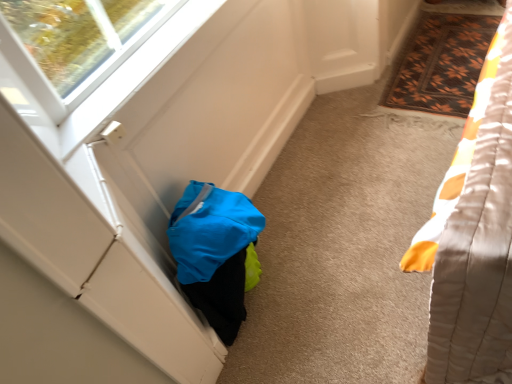
What do you see at coordinates (86, 58) in the screenshot? I see `clear glass window at upper left` at bounding box center [86, 58].

Locate an element on the screen. This screenshot has height=384, width=512. clear glass window at upper left is located at coordinates (86, 58).

At what (x,y) coordinates should I click in order to perform the action: click on clear glass window at upper left. Please return your answer as a coordinate pair (x, y). The image size is (512, 384). Looking at the image, I should click on (86, 58).